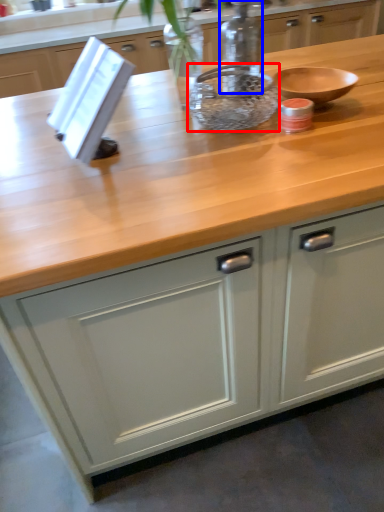
Question: Which object appears closest to the camera in this image, bowl (highlighted by a red box) or bottle (highlighted by a blue box)?

Choices:
 (A) bowl
 (B) bottle

Answer: (A)